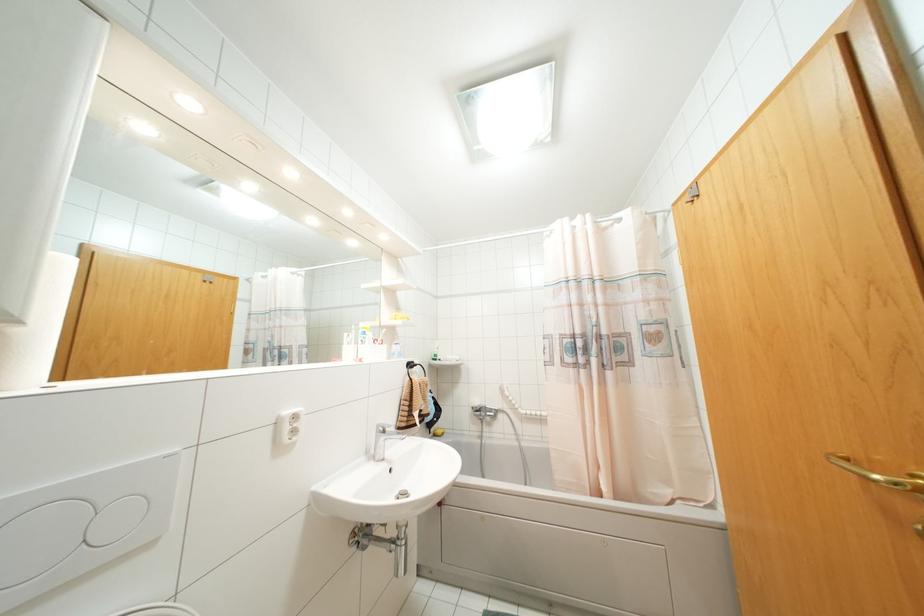
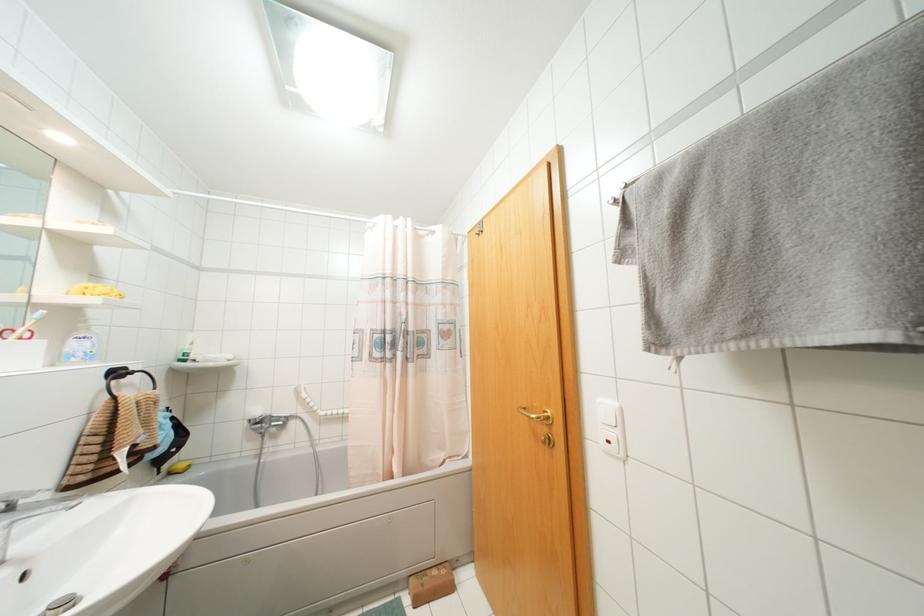
Question: The first image is from the beginning of the video and the second image is from the end. How did the camera likely rotate when shooting the video?

Choices:
 (A) Left
 (B) Right
 (C) Up
 (D) Down

Answer: (B)